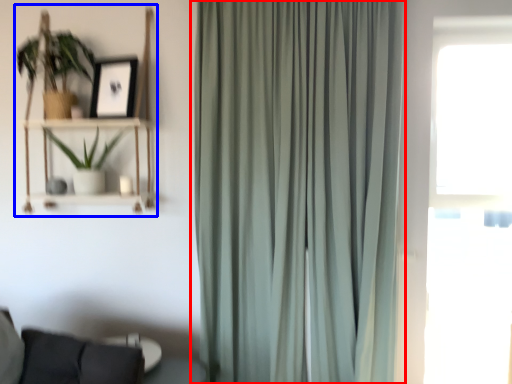
Question: Among these objects, which one is farthest to the camera, curtain (highlighted by a red box) or bookshelf (highlighted by a blue box)?

Choices:
 (A) curtain
 (B) bookshelf

Answer: (B)